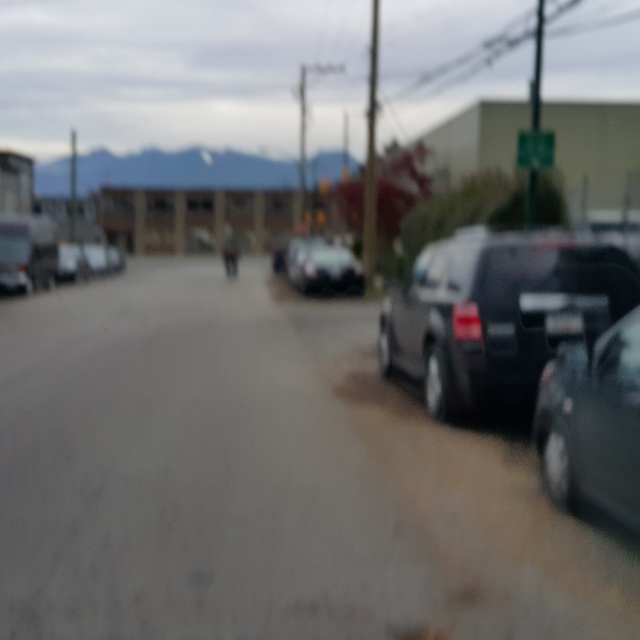
Question: Considering the relative positions of matte black van at right and satin black car at center in the image provided, where is matte black van at right located with respect to satin black car at center?

Choices:
 (A) left
 (B) right

Answer: (B)

Question: Is matte black van at right to the right of satin black car at center from the viewer's perspective?

Choices:
 (A) yes
 (B) no

Answer: (A)

Question: Among these objects, which one is nearest to the camera?

Choices:
 (A) satin black car at right
 (B) matte black van at right

Answer: (A)

Question: Which of the following is the farthest from the observer?

Choices:
 (A) satin black car at right
 (B) satin black car at center

Answer: (B)

Question: Which of the following is the closest to the observer?

Choices:
 (A) matte black van at right
 (B) satin black car at right

Answer: (B)

Question: Does matte black van at right lie behind satin black car at right?

Choices:
 (A) yes
 (B) no

Answer: (A)